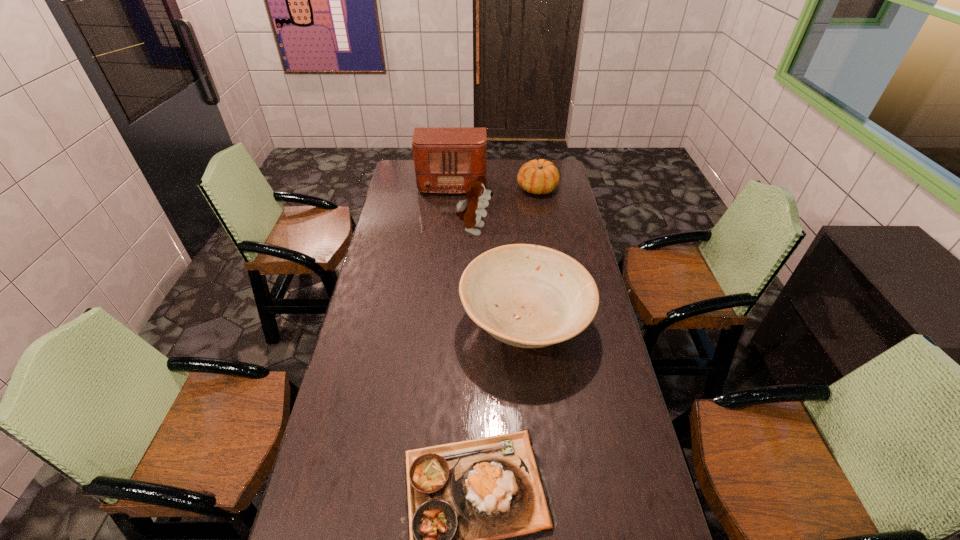
The width and height of the screenshot is (960, 540). I want to click on gourd at the far edge, so click(540, 176).

Locate an element on the screen. The image size is (960, 540). object that is at the left edge is located at coordinates (445, 159).

The height and width of the screenshot is (540, 960). What are the coordinates of `dish that is at the right edge` in the screenshot? It's located at (529, 296).

The image size is (960, 540). I want to click on gourd situated at the right edge, so click(x=540, y=176).

This screenshot has height=540, width=960. I want to click on object present at the far left corner, so click(x=445, y=159).

I want to click on object that is at the far right corner, so click(x=540, y=176).

Where is `free space at the far edge`? free space at the far edge is located at coordinates (505, 179).

Locate an element on the screen. vacant space at the left edge of the desktop is located at coordinates (356, 522).

In the image, there is a desktop. Where is `vacant space at the right edge`? vacant space at the right edge is located at coordinates (592, 381).

Identify the location of free region at the far left corner of the desktop. (395, 183).